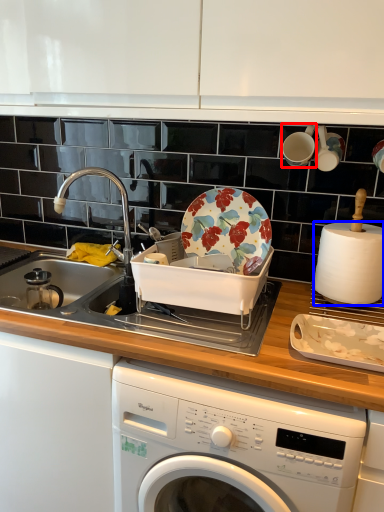
Question: Among these objects, which one is farthest to the camera, tableware (highlighted by a red box) or paper towel (highlighted by a blue box)?

Choices:
 (A) tableware
 (B) paper towel

Answer: (A)